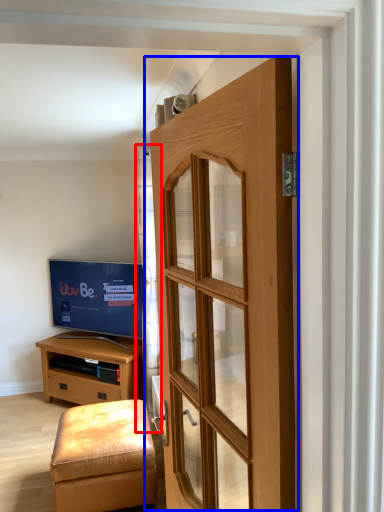
Question: Which object is closer to the camera taking this photo, curtain (highlighted by a red box) or door (highlighted by a blue box)?

Choices:
 (A) curtain
 (B) door

Answer: (B)